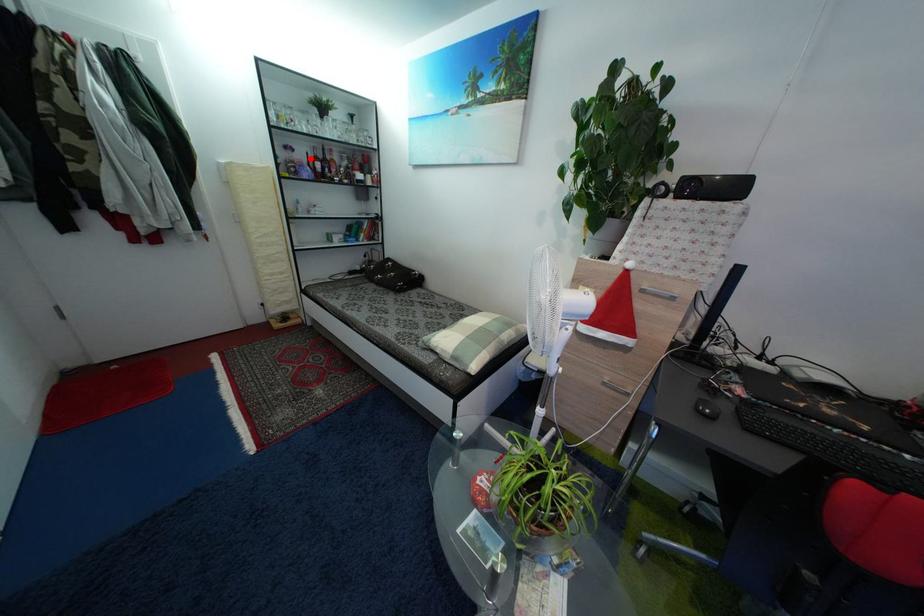
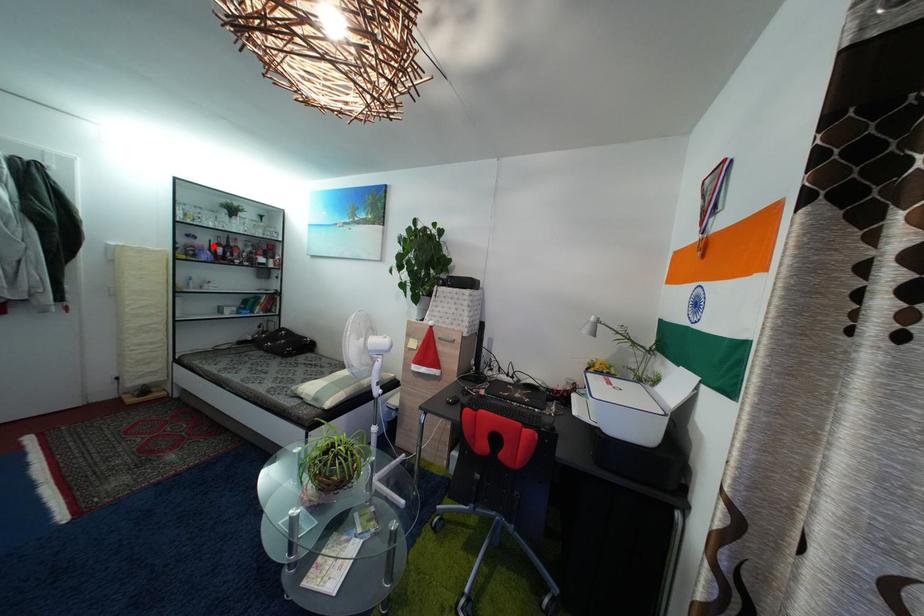
I am providing you with two images of the same scene from different viewpoints. A red point is marked on the first image and another point is marked on the second image. Is the red point in image1 aligned with the point shown in image2?

Yes